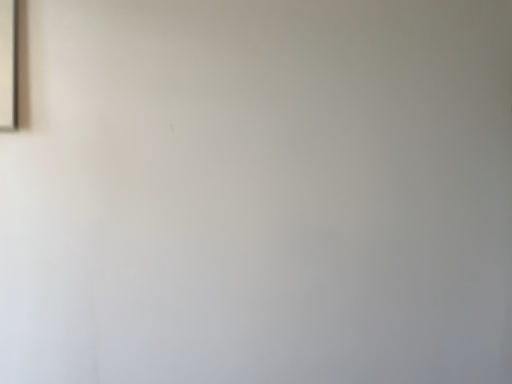
Describe the element at coordinates (8, 65) in the screenshot. I see `metallic silver picture frame at left` at that location.

Image resolution: width=512 pixels, height=384 pixels. What are the coordinates of `metallic silver picture frame at left` in the screenshot? It's located at coord(8,65).

Find the location of a particular element. This screenshot has width=512, height=384. metallic silver picture frame at left is located at coordinates (8, 65).